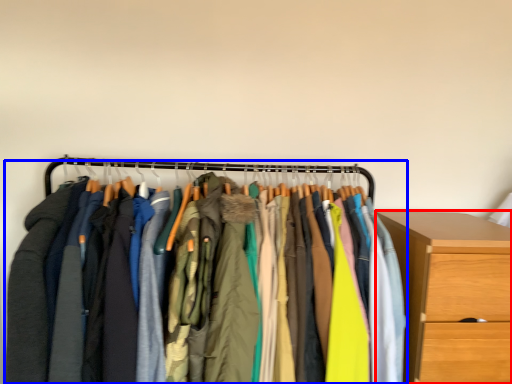
Question: Which point is further to the camera, chest of drawers (highlighted by a red box) or closet (highlighted by a blue box)?

Choices:
 (A) chest of drawers
 (B) closet

Answer: (A)